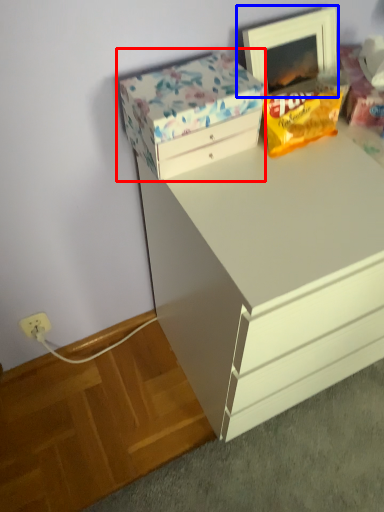
Question: Which object appears closest to the camera in this image, storage box (highlighted by a red box) or picture frame (highlighted by a blue box)?

Choices:
 (A) storage box
 (B) picture frame

Answer: (A)